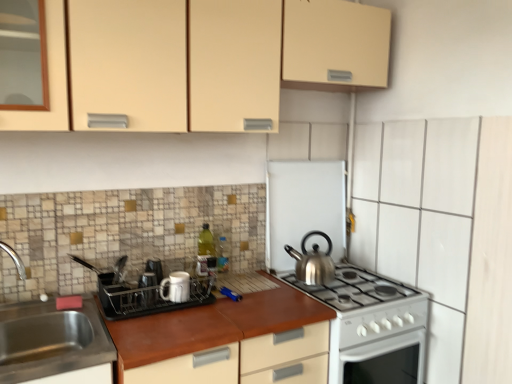
The image size is (512, 384). Identify the location of vacant space to the right of white ceramic mug at center, arranged as the 2th appliance when viewed from the back. (205, 307).